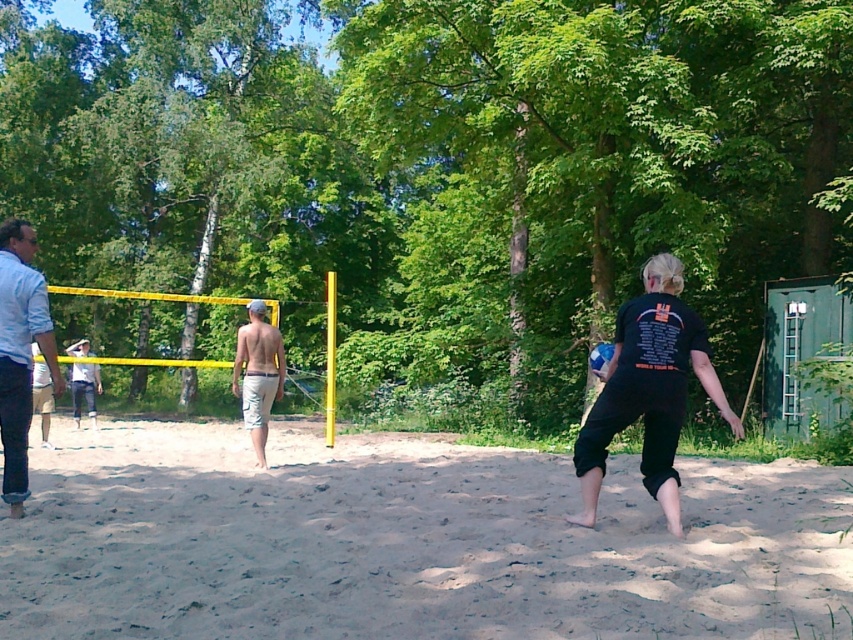
You are a photographer trying to capture a wide shot of the volleyball game. You notice the light blue denim shirt at left and the tan shorts at center in your frame. Which object should you adjust your focus on if you want to ensure the thinner one is in sharp focus?

The light blue denim shirt at left is thinner than the tan shorts at center, so you should focus on the light blue denim shirt at left to ensure it is in sharp focus.